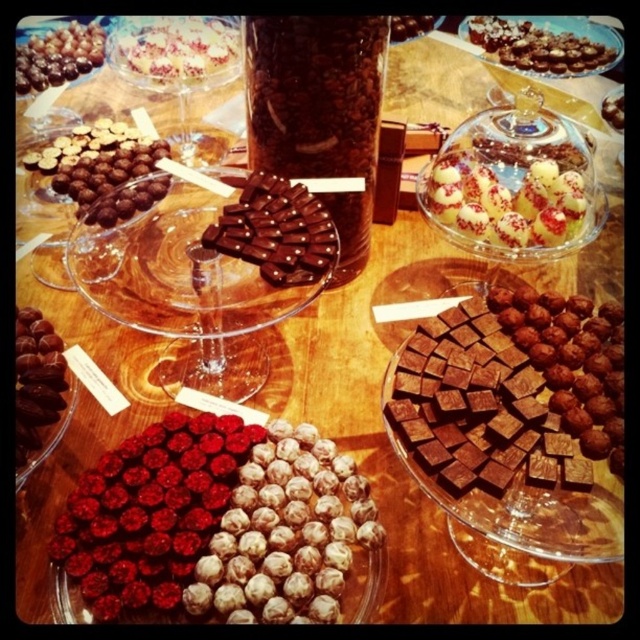
Question: Among these points, which one is farthest from the camera?

Choices:
 (A) (288, 442)
 (B) (480, 164)
 (C) (436, 378)

Answer: (B)

Question: Is dark chocolate nuts at upper left wider than shiny chocolate at center?

Choices:
 (A) yes
 (B) no

Answer: (A)

Question: Considering the relative positions of dark chocolate cubes at center and white textured cake at upper left in the image provided, where is dark chocolate cubes at center located with respect to white textured cake at upper left?

Choices:
 (A) above
 (B) below

Answer: (B)

Question: Among these objects, which one is nearest to the camera?

Choices:
 (A) shiny chocolate truffles at upper left
 (B) dark chocolate cubes at center
 (C) dark chocolate nuts at upper left

Answer: (B)

Question: Considering the relative positions of white textured cake at upper left and shiny dark chocolate at bottom left in the image provided, where is white textured cake at upper left located with respect to shiny dark chocolate at bottom left?

Choices:
 (A) above
 (B) below

Answer: (A)

Question: Which of the following is the farthest from the observer?

Choices:
 (A) (307, 504)
 (B) (32, 384)
 (C) (397, 26)
 (D) (186, 67)

Answer: (C)